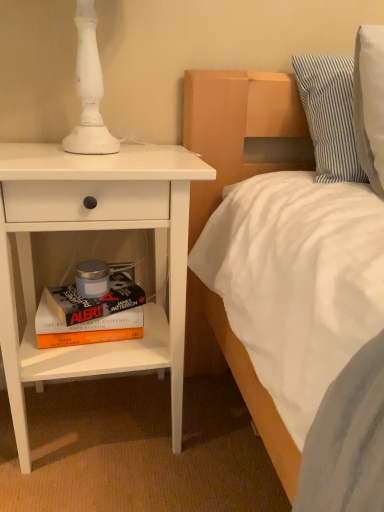
Question: Considering the relative sizes of hardcover book at lower left and white matte nightstand at left in the image provided, is hardcover book at lower left thinner than white matte nightstand at left?

Choices:
 (A) yes
 (B) no

Answer: (A)

Question: Does hardcover book at lower left touch white matte nightstand at left?

Choices:
 (A) yes
 (B) no

Answer: (B)

Question: From the image's perspective, does hardcover book at lower left appear lower than white matte nightstand at left?

Choices:
 (A) yes
 (B) no

Answer: (A)

Question: Is hardcover book at lower left in front of white matte nightstand at left?

Choices:
 (A) no
 (B) yes

Answer: (A)

Question: From a real-world perspective, is hardcover book at lower left below white matte nightstand at left?

Choices:
 (A) no
 (B) yes

Answer: (B)

Question: From the image's perspective, is hardcover book at lower left located above white matte nightstand at left?

Choices:
 (A) yes
 (B) no

Answer: (B)

Question: Is white matte nightstand at left located within blue striped pillow at upper right?

Choices:
 (A) yes
 (B) no

Answer: (B)

Question: Are blue striped pillow at upper right and white matte nightstand at left far apart?

Choices:
 (A) no
 (B) yes

Answer: (A)

Question: Can you confirm if blue striped pillow at upper right is wider than white matte nightstand at left?

Choices:
 (A) no
 (B) yes

Answer: (A)

Question: Does blue striped pillow at upper right have a lesser width compared to white matte nightstand at left?

Choices:
 (A) no
 (B) yes

Answer: (B)

Question: Is blue striped pillow at upper right shorter than white matte nightstand at left?

Choices:
 (A) no
 (B) yes

Answer: (B)

Question: Can you confirm if blue striped pillow at upper right is positioned to the left of white matte nightstand at left?

Choices:
 (A) yes
 (B) no

Answer: (B)

Question: Is white matte nightstand at left wider than hardcover book at lower left?

Choices:
 (A) no
 (B) yes

Answer: (B)